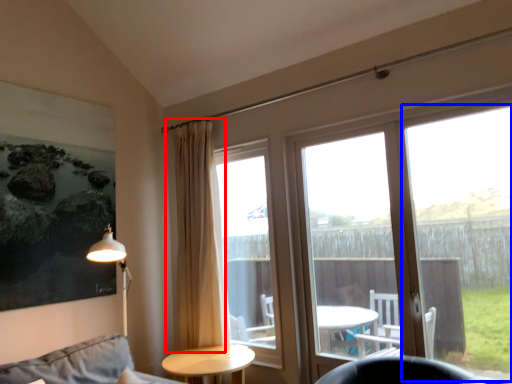
Question: Which object is closer to the camera taking this photo, curtain (highlighted by a red box) or window frame (highlighted by a blue box)?

Choices:
 (A) curtain
 (B) window frame

Answer: (B)